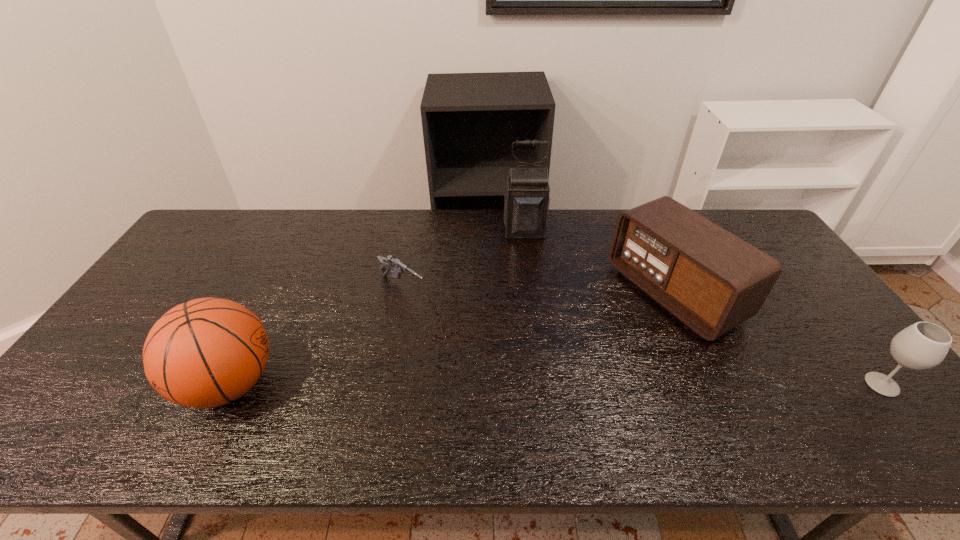
You are a GUI agent. You are given a task and a screenshot of the screen. Output one action in this format:
    pyautogui.click(x=<x>, y=<y>)
    Task: Click on the vacant region between the fourth object from left to right and the rightmost object
    
    Given the screenshot: What is the action you would take?
    pyautogui.click(x=778, y=339)

Locate an element on the screen. The width and height of the screenshot is (960, 540). unoccupied area between the leftmost object and the wineglass is located at coordinates click(x=556, y=384).

At what (x,y) coordinates should I click in order to perform the action: click on free space between the third object from right to left and the basketball. Please return your answer as a coordinate pair (x, y). This screenshot has height=540, width=960. Looking at the image, I should click on (377, 307).

Where is `free space between the radio receiver and the tallest object`? free space between the radio receiver and the tallest object is located at coordinates (599, 261).

Where is `free space between the basketball and the rightmost object`? free space between the basketball and the rightmost object is located at coordinates (556, 384).

Where is `unoccupied area between the gun and the fourth object from left to right`? The image size is (960, 540). unoccupied area between the gun and the fourth object from left to right is located at coordinates (538, 289).

This screenshot has width=960, height=540. I want to click on unoccupied position between the radio receiver and the rightmost object, so [x=778, y=339].

Locate which object ranks second in proximity to the leftmost object. Please provide its 2D coordinates. Your answer should be formatted as a tuple, i.e. [(x, y)], where the tuple contains the x and y coordinates of a point satisfying the conditions above.

[(526, 199)]

Locate which object is the closest to the rightmost object. Please provide its 2D coordinates. Your answer should be formatted as a tuple, i.e. [(x, y)], where the tuple contains the x and y coordinates of a point satisfying the conditions above.

[(710, 279)]